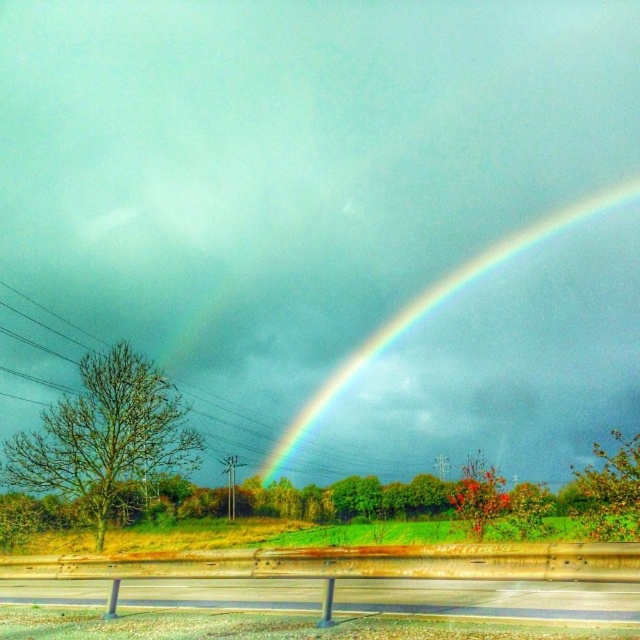
Is metallic gray highway at lower center to the left of rainbow at upper center from the viewer's perspective?

Yes, metallic gray highway at lower center is to the left of rainbow at upper center.

Between point (252, 592) and point (403, 321), which one is positioned in front?

Positioned in front is point (252, 592).

Find the location of a particular element. metallic gray highway at lower center is located at coordinates (490, 598).